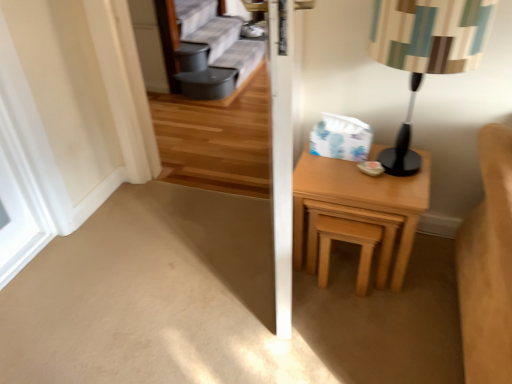
Locate an element on the screen. free space in front of white matte window at left is located at coordinates (67, 241).